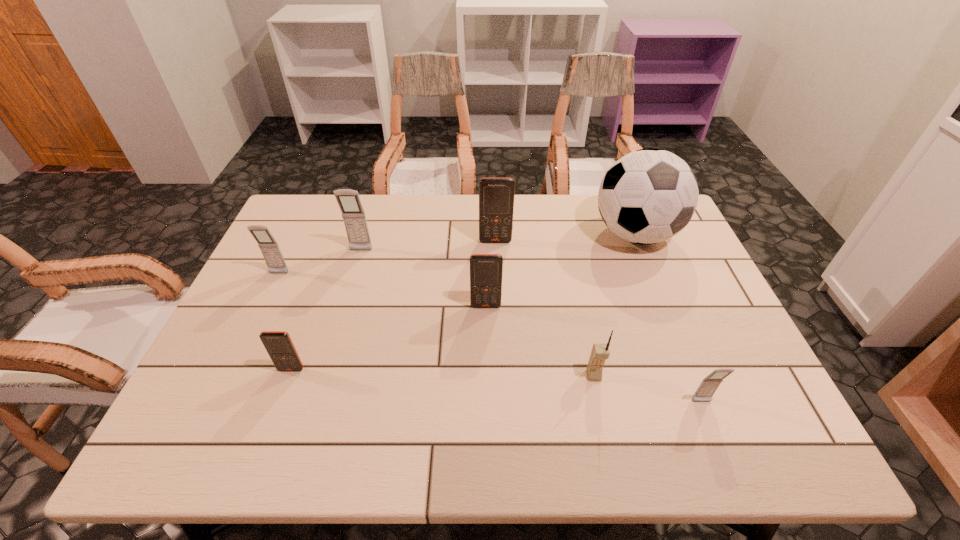
What are the coordinates of `vacant space at the left edge of the desktop` in the screenshot? It's located at (307, 280).

Locate an element on the screen. free space at the right edge of the desktop is located at coordinates (739, 394).

Image resolution: width=960 pixels, height=540 pixels. In order to click on vacant space at the near left corner of the desktop in this screenshot , I will do `click(247, 428)`.

This screenshot has width=960, height=540. I want to click on vacant space at the near right corner of the desktop, so click(x=722, y=458).

At what (x,y) coordinates should I click in order to perform the action: click on vacant space that's between the sixth object from right to left and the leftmost gray cellular telephone. Please return your answer as a coordinate pair (x, y). Image resolution: width=960 pixels, height=540 pixels. Looking at the image, I should click on (320, 262).

What are the coordinates of `free space between the second farthest orange cellular telephone and the second cellular telephone from left to right` in the screenshot? It's located at (389, 338).

Locate an element on the screen. The width and height of the screenshot is (960, 540). free space between the sixth cellular telephone from right to left and the third cellular telephone from left to right is located at coordinates (326, 310).

What are the coordinates of `empty space between the biggest orange cellular telephone and the fifth nearest object` in the screenshot? It's located at click(x=387, y=258).

Where is `vacant area that lies between the third farthest cellular telephone and the farthest cellular telephone`? The height and width of the screenshot is (540, 960). vacant area that lies between the third farthest cellular telephone and the farthest cellular telephone is located at coordinates (387, 258).

I want to click on vacant space that is in between the sixth cellular telephone from left to right and the smallest orange cellular telephone, so (x=443, y=372).